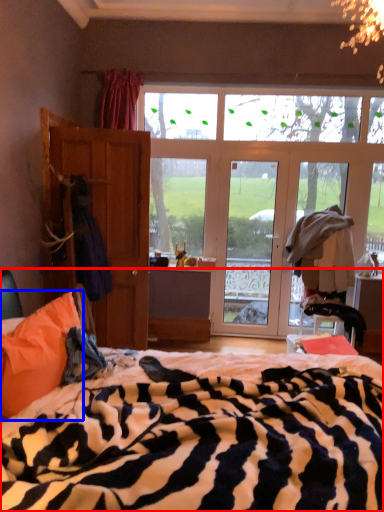
Question: Which point is further to the camera, bed (highlighted by a red box) or pillow (highlighted by a blue box)?

Choices:
 (A) bed
 (B) pillow

Answer: (B)